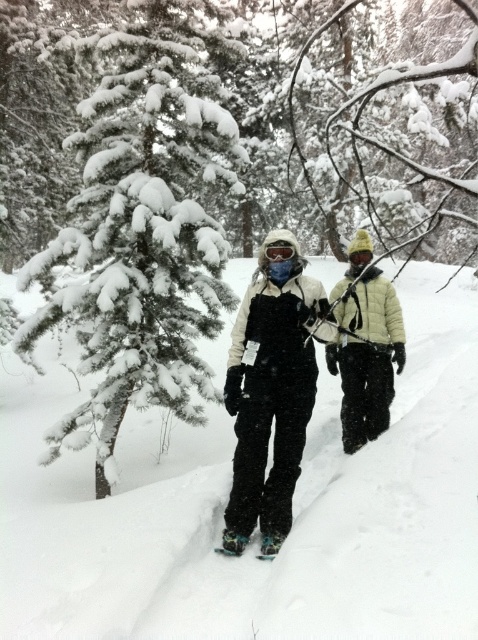
Question: Can you confirm if snow-covered evergreen at left is bigger than light yellow down jacket at center?

Choices:
 (A) no
 (B) yes

Answer: (B)

Question: Can you confirm if matte blue goggles at center is positioned to the right of green rubber snowshoe at center?

Choices:
 (A) yes
 (B) no

Answer: (A)

Question: Estimate the real-world distances between objects in this image. Which object is farther from the green rubber snowshoe at center?

Choices:
 (A) matte black snowsuit at center
 (B) blue rubber snowshoe at lower center

Answer: (A)

Question: Which of these objects is positioned closest to the light yellow down jacket at center?

Choices:
 (A) white rubber snowshoe at lower center
 (B) matte black snowsuit at center
 (C) matte blue goggles at center

Answer: (B)

Question: Among these objects, which one is farthest from the camera?

Choices:
 (A) white fluffy snow at center
 (B) light yellow down jacket at center
 (C) green rubber snowshoe at center
 (D) snow-covered pine tree at left

Answer: (B)

Question: From the image, what is the correct spatial relationship of white fluffy snow at center in relation to snow-covered pine tree at left?

Choices:
 (A) below
 (B) above

Answer: (A)